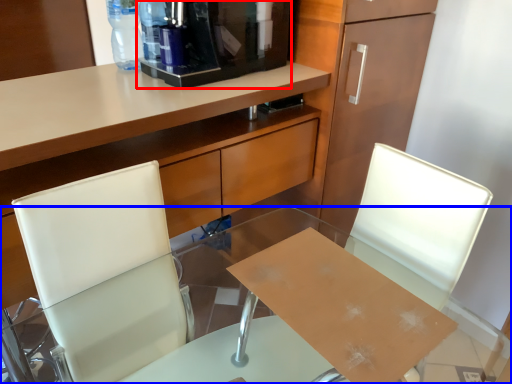
Question: Which of the following is the closest to the observer, coffee machine (highlighted by a red box) or desk (highlighted by a blue box)?

Choices:
 (A) coffee machine
 (B) desk

Answer: (B)